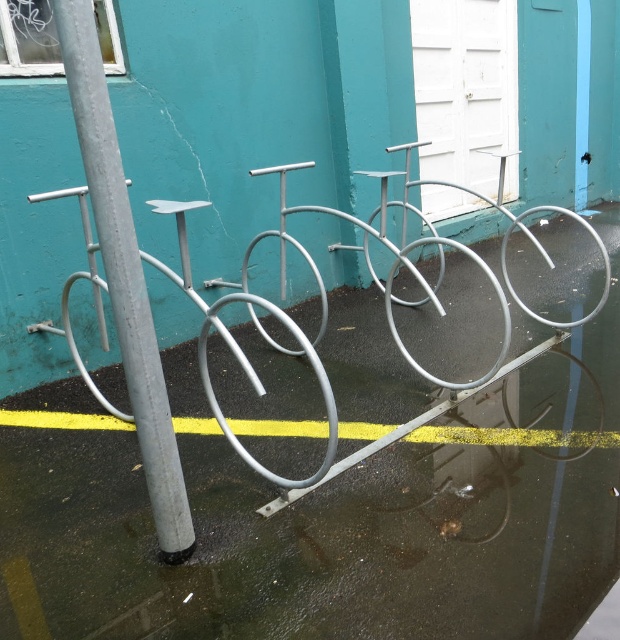
Does smooth gray pole at left lie behind metallic silver bicycle at left?

No, smooth gray pole at left is closer to the viewer.

Is smooth gray pole at left smaller than metallic silver bicycle at left?

Yes.

Which is behind, point (126, 344) or point (64, 301)?

The point (64, 301) is behind.

Find the location of a particular element. The width and height of the screenshot is (620, 640). smooth gray pole at left is located at coordinates (125, 276).

Is metallic silver bicycle at left further to the viewer compared to yellow painted line at lower center?

No, metallic silver bicycle at left is closer to the viewer.

The width and height of the screenshot is (620, 640). What are the coordinates of `metallic silver bicycle at left` in the screenshot? It's located at (241, 348).

Between smooth gray pole at left and yellow painted line at lower center, which one has less height?

With less height is yellow painted line at lower center.

Does smooth gray pole at left have a greater height compared to yellow painted line at lower center?

Indeed, smooth gray pole at left has a greater height compared to yellow painted line at lower center.

You are a GUI agent. You are given a task and a screenshot of the screen. Output one action in this format:
    pyautogui.click(x=<x>, y=<y>)
    Task: Click on the smooth gray pole at left
    
    Given the screenshot: What is the action you would take?
    pyautogui.click(x=125, y=276)

Identify the location of smooth gray pole at left. The width and height of the screenshot is (620, 640). (125, 276).